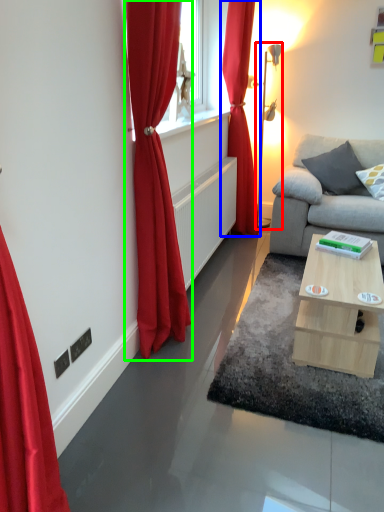
Question: Which object is positioned farthest from table lamp (highlighted by a red box)? Select from curtain (highlighted by a blue box) and curtain (highlighted by a green box).

Choices:
 (A) curtain
 (B) curtain

Answer: (B)